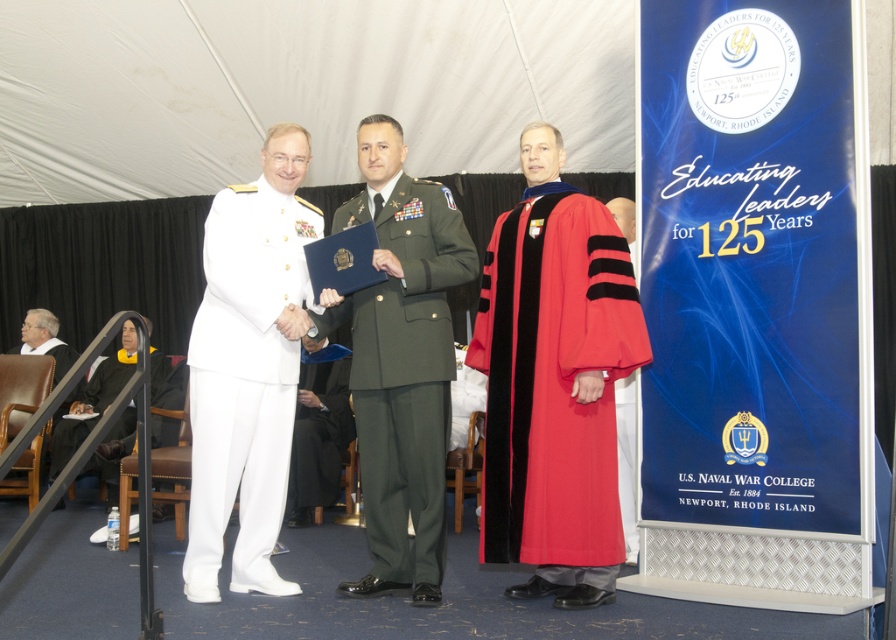
Question: Does velvet red graduation gown at center have a smaller size compared to black fabric graduation gown at lower left?

Choices:
 (A) no
 (B) yes

Answer: (B)

Question: Among these points, which one is nearest to the camera?

Choices:
 (A) (220, 499)
 (B) (113, 355)
 (C) (386, 211)
 (D) (524, 493)

Answer: (D)

Question: Among these objects, which one is farthest from the camera?

Choices:
 (A) black fabric graduation gown at lower left
 (B) green matte uniform at center

Answer: (A)

Question: Which object is closer to the camera taking this photo?

Choices:
 (A) white matte uniform at left
 (B) green matte uniform at center
 (C) velvet red graduation gown at center
 (D) black fabric graduation gown at lower left

Answer: (C)

Question: Does velvet red graduation gown at center appear on the right side of black fabric graduation gown at lower left?

Choices:
 (A) no
 (B) yes

Answer: (B)

Question: Is velvet red graduation gown at center to the right of black fabric graduation gown at lower left from the viewer's perspective?

Choices:
 (A) no
 (B) yes

Answer: (B)